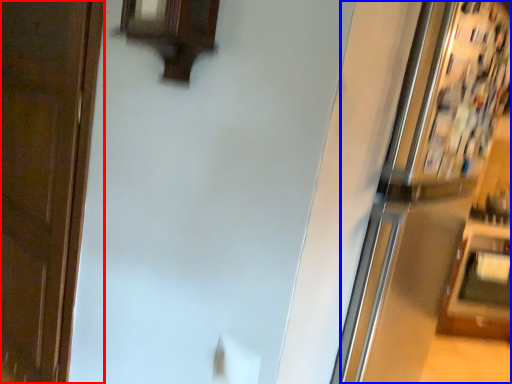
Question: Which object appears closest to the camera in this image, door (highlighted by a red box) or fridge (highlighted by a blue box)?

Choices:
 (A) door
 (B) fridge

Answer: (B)